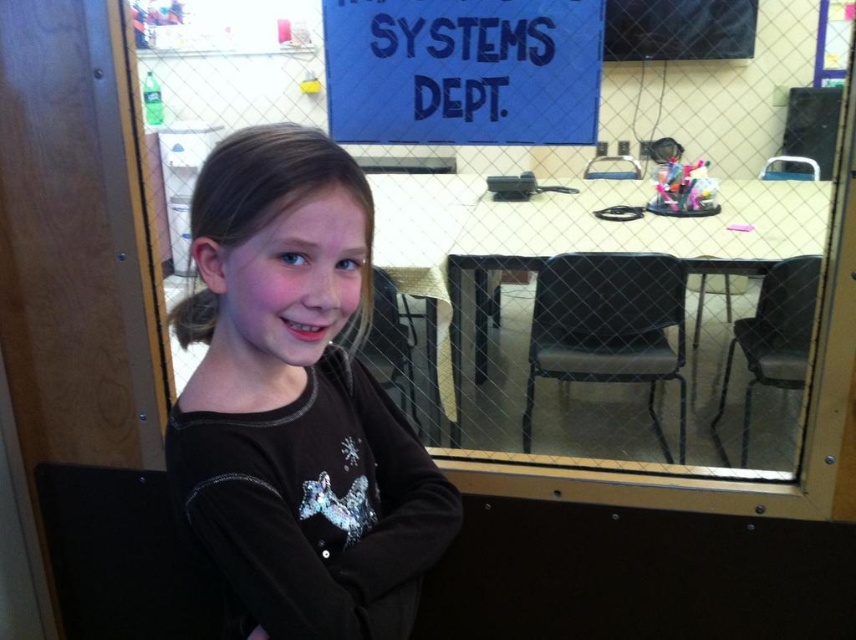
You are standing in the same room as the young girl in the image. You want to place a small sticker exactly at the point labeled point (302, 301). If your hand is 28 inches away from where you are standing, will you be able to reach that point?

The point (302, 301) is 28.74 inches away from the viewer. Since your hand can reach 28 inches, you are just slightly out of reach by 0.74 inches.

Based on the photo, you are a visitor in an office building and see the dark brown fleece at center and the blue fabric sign at upper center through the glass partition. Which object is bigger in size?

The dark brown fleece at center is larger in size compared to the blue fabric sign at upper center.

You are a visitor in the building and want to pick up the dark brown fleece at center and the blue fabric sign at upper center. Which object do you need to step closer to reach first?

The dark brown fleece at center is closer to the viewer than the blue fabric sign at upper center, so you need to step closer to reach the blue fabric sign at upper center first.